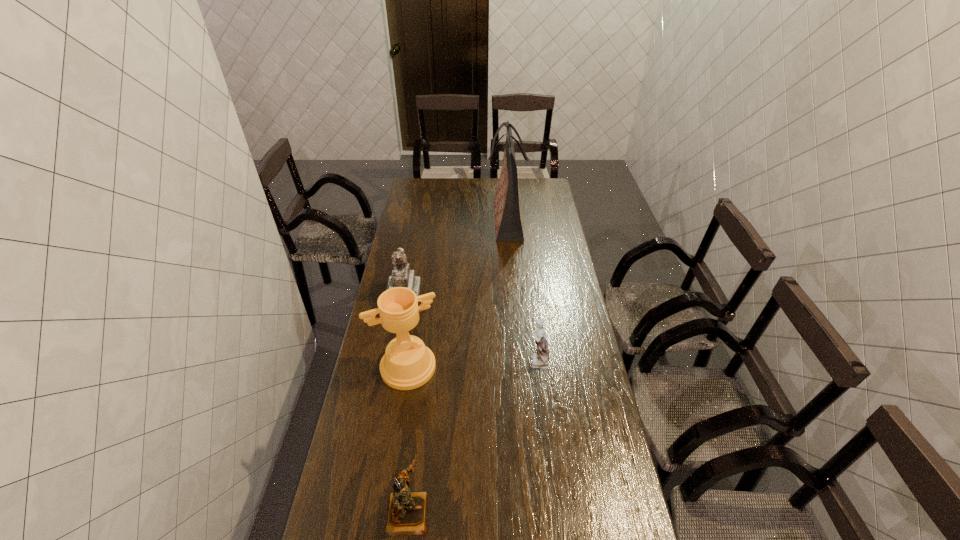
Select which object is the closest to the award. Please provide its 2D coordinates. Your answer should be formatted as a tuple, i.e. [(x, y)], where the tuple contains the x and y coordinates of a point satisfying the conditions above.

[(402, 276)]

I want to click on object that can be found as the third closest to the rightmost figurine, so click(x=406, y=515).

Select which figurine appears as the closest to the rightmost figurine. Please provide its 2D coordinates. Your answer should be formatted as a tuple, i.e. [(x, y)], where the tuple contains the x and y coordinates of a point satisfying the conditions above.

[(402, 276)]

Find the location of `figurine that is the closest to the second nearest figurine`. figurine that is the closest to the second nearest figurine is located at coordinates (402, 276).

Locate an element on the screen. This screenshot has height=540, width=960. free spot that satisfies the following two spatial constraints: 1. on the back side of the award; 2. on the front-facing side of the fourth nearest object is located at coordinates (419, 296).

This screenshot has width=960, height=540. What are the coordinates of `vacant space that satisfies the following two spatial constraints: 1. on the front-facing side of the second farthest object; 2. on the right side of the second tallest object` in the screenshot? It's located at (390, 367).

In order to click on blank space that satisfies the following two spatial constraints: 1. on the back side of the award; 2. on the front-facing side of the farthest figurine in this screenshot , I will do `click(419, 296)`.

The height and width of the screenshot is (540, 960). Identify the location of free space that satisfies the following two spatial constraints: 1. on the front-facing side of the second farthest object; 2. on the left side of the fourth shortest object. (390, 367).